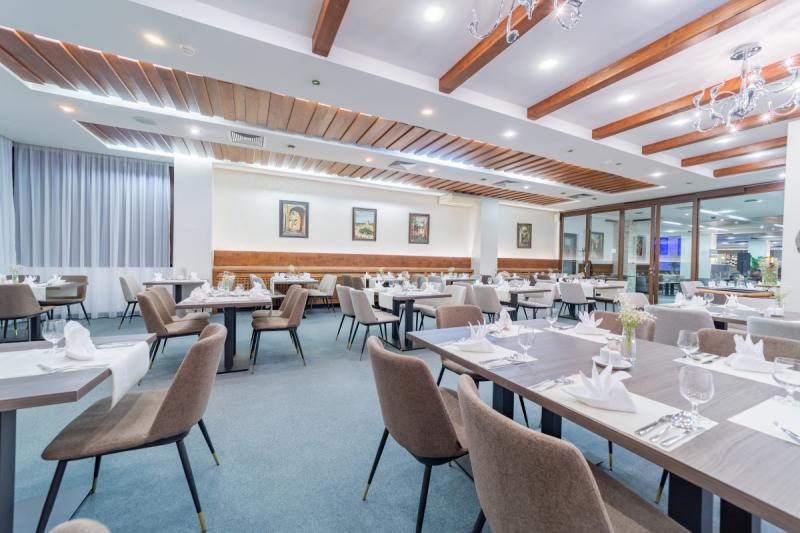
I want to click on flower vases, so 225,280, 630,338, 780,302, 14,276.